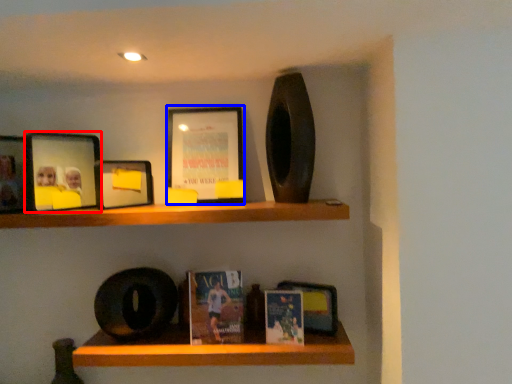
Question: Among these objects, which one is farthest to the camera, picture frame (highlighted by a red box) or picture frame (highlighted by a blue box)?

Choices:
 (A) picture frame
 (B) picture frame

Answer: (B)